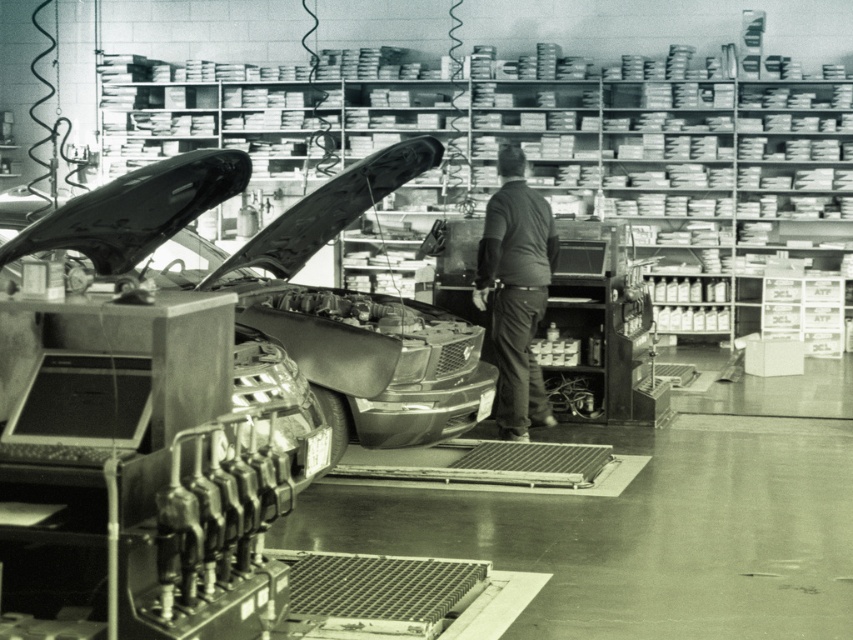
You are a mechanic working in the garage. You see the shiny chrome car at center and the dark gray shirt at center. Which object is closer to you?

The shiny chrome car at center is closer to you because it is in front of the dark gray shirt at center.

You are a mechanic working in the garage. You need to determine if the shiny chrome car at center can be lifted using a jack that requires the vehicle to be at least 1.2 meters tall. Given the dark gray shirt at center is 1.8 meters tall, can the car be lifted?

The shiny chrome car at center is shorter than the dark gray shirt at center, which is 1.8 meters tall. Since the car is shorter than 1.8 meters, it is below the required 1.2 meters height for the jack. Therefore, the car cannot be lifted using the jack.